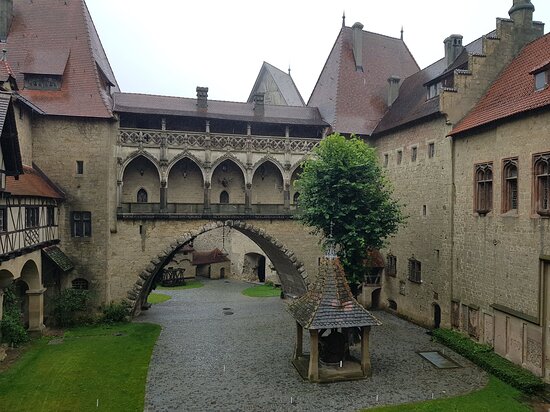
Locate an element on the screen. This screenshot has height=412, width=550. window is located at coordinates (489, 171).